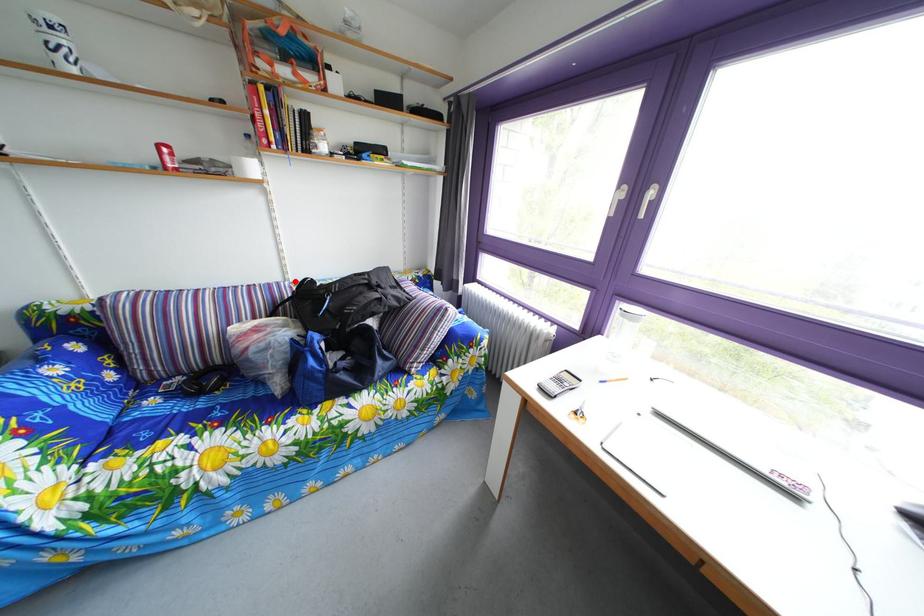
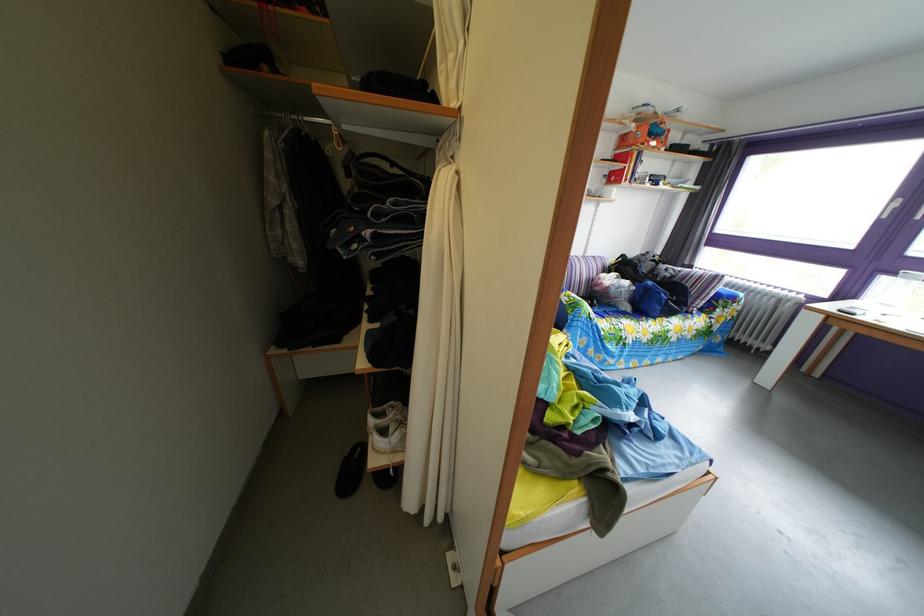
Where in the second image is the point corresponding to the highlighted location from the first image?

(596, 261)